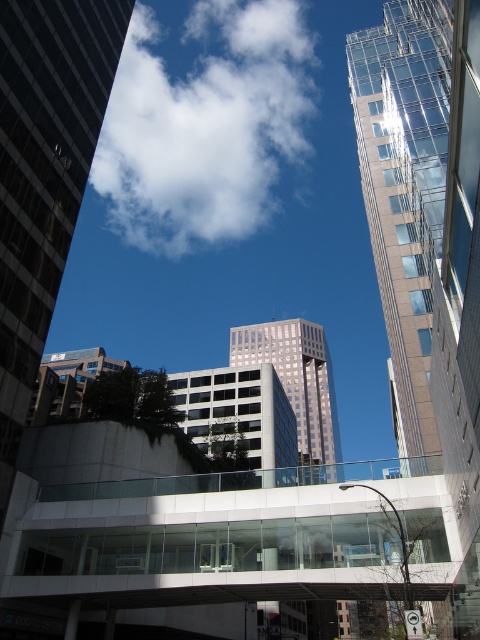
You are standing on the pedestrian bridge and looking up at the sky. There is a point marked at coordinates (204, 125) in the image. What object is located at that point?

The white fluffy cloud at upper center is located at point (204, 125).

You are an architect designing a new skyscraper in this city. You want to ensure the building doesn not block the view of the white fluffy cloud at upper center from the pedestrian bridge. Given the cloud is located at coordinates point 0.197, 0.427, what should you consider in your design?

The white fluffy cloud at upper center is located at point [204,125]. To ensure the new skyscraper does not block this view from the pedestrian bridge, the building should be positioned and sized so that its structure does not obstruct the line of sight to the cloud at those coordinates.

You are an architect evaluating the urban skyline. From your vantage point, which object blocks the view of the other between the white fluffy cloud at upper center and the clear glass skyscraper at upper right?

The white fluffy cloud at upper center blocks the view of the clear glass skyscraper at upper right because the skyscraper is positioned behind the cloud.